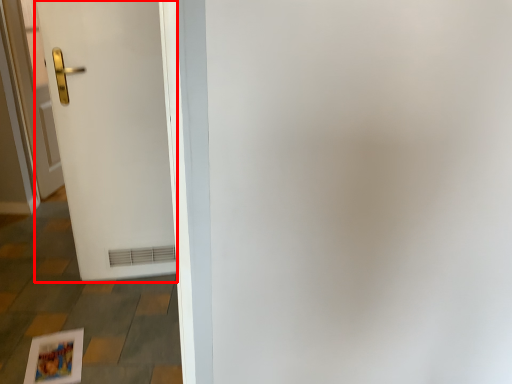
Question: From the image's perspective, what is the correct spatial relationship of door (annotated by the red box) in relation to door?

Choices:
 (A) below
 (B) above

Answer: (A)